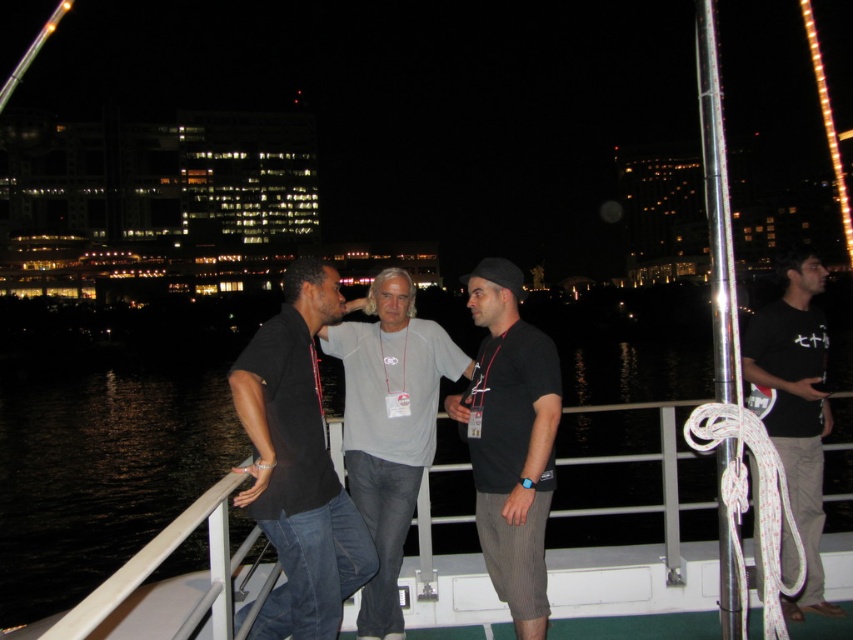
Question: Does black cotton shirt at center have a larger size compared to black cotton t-shirt at right?

Choices:
 (A) yes
 (B) no

Answer: (A)

Question: Which object appears closest to the camera in this image?

Choices:
 (A) black cotton t-shirt at right
 (B) black matte t-shirt at center

Answer: (B)

Question: Does black cotton shirt at center appear on the right side of black matte t-shirt at center?

Choices:
 (A) no
 (B) yes

Answer: (A)

Question: Is gray cotton t-shirt at center positioned behind black cotton t-shirt at right?

Choices:
 (A) yes
 (B) no

Answer: (B)

Question: Estimate the real-world distances between objects in this image. Which object is closer to the black cotton shirt at center?

Choices:
 (A) black cotton t-shirt at right
 (B) black matte t-shirt at center

Answer: (B)

Question: Which object is farther from the camera taking this photo?

Choices:
 (A) black cotton shirt at center
 (B) black cotton t-shirt at right

Answer: (B)